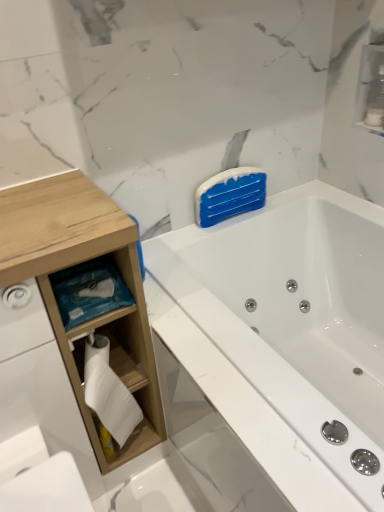
Identify the location of white glossy bathtub at upper right. This screenshot has height=512, width=384. (287, 335).

Is wooden cabinet at left facing away from white glossy cabinet at upper right, which is counted as the first cabinet, starting from the top?

No, white glossy cabinet at upper right, which is counted as the first cabinet, starting from the top, is not at the back of wooden cabinet at left.

From the image's perspective, is wooden cabinet at left beneath white glossy cabinet at upper right, which is counted as the first cabinet, starting from the top?

Correct, wooden cabinet at left appears lower than white glossy cabinet at upper right, which is counted as the first cabinet, starting from the top, in the image.

Based on the photo, which object is more forward, wooden cabinet at left or white glossy cabinet at upper right, which is the second cabinet in left-to-right order?

wooden cabinet at left.

Considering the relative positions of white glossy cabinet at upper right, which is the 2th cabinet from bottom to top, and white wood toilet paper holder at left, arranged as the first cabinet when viewed from the left, in the image provided, is white glossy cabinet at upper right, which is the 2th cabinet from bottom to top, to the left of white wood toilet paper holder at left, arranged as the first cabinet when viewed from the left, from the viewer's perspective?

In fact, white glossy cabinet at upper right, which is the 2th cabinet from bottom to top, is to the right of white wood toilet paper holder at left, arranged as the first cabinet when viewed from the left.

Is white glossy cabinet at upper right, which is the 1th cabinet from right to left, oriented away from white wood toilet paper holder at left, the 1th cabinet in the bottom-to-top sequence?

No, white glossy cabinet at upper right, which is the 1th cabinet from right to left, is not facing the opposite direction of white wood toilet paper holder at left, the 1th cabinet in the bottom-to-top sequence.

From a real-world perspective, relative to white wood toilet paper holder at left, the 2th cabinet in the top-to-bottom sequence, is white glossy cabinet at upper right, which is the second cabinet in left-to-right order, vertically above or below?

Clearly, from a real-world perspective, white glossy cabinet at upper right, which is the second cabinet in left-to-right order, is above white wood toilet paper holder at left, the 2th cabinet in the top-to-bottom sequence.

Is white glossy cabinet at upper right, which is the second cabinet in left-to-right order, not near white wood toilet paper holder at left, the 2th cabinet from the right?

Absolutely, white glossy cabinet at upper right, which is the second cabinet in left-to-right order, is distant from white wood toilet paper holder at left, the 2th cabinet from the right.

Is white glossy bathtub at upper right turned away from wooden cabinet at left?

No, white glossy bathtub at upper right's orientation is not away from wooden cabinet at left.

Locate an element on the screen. The image size is (384, 512). cabinetry behind the white glossy bathtub at upper right is located at coordinates (76, 264).

Considering the positions of objects white glossy bathtub at upper right and wooden cabinet at left in the image provided, who is more to the right, white glossy bathtub at upper right or wooden cabinet at left?

Positioned to the right is white glossy bathtub at upper right.

Is wooden cabinet at left located within white glossy bathtub at upper right?

Actually, wooden cabinet at left is outside white glossy bathtub at upper right.

Can you confirm if wooden cabinet at left is wider than white glossy bathtub at upper right?

Incorrect, the width of wooden cabinet at left does not surpass that of white glossy bathtub at upper right.

From the image's perspective, is wooden cabinet at left located above or below white glossy bathtub at upper right?

wooden cabinet at left is above white glossy bathtub at upper right.

Does wooden cabinet at left have a lesser height compared to white glossy bathtub at upper right?

In fact, wooden cabinet at left may be taller than white glossy bathtub at upper right.

Does point (30, 190) appear closer or farther from the camera than point (270, 428)?

Point (30, 190) is positioned farther from the camera compared to point (270, 428).

Considering the positions of objects white wood toilet paper holder at left, the 2th cabinet in the top-to-bottom sequence, and white glossy bathtub at upper right in the image provided, who is more to the left, white wood toilet paper holder at left, the 2th cabinet in the top-to-bottom sequence, or white glossy bathtub at upper right?

From the viewer's perspective, white wood toilet paper holder at left, the 2th cabinet in the top-to-bottom sequence, appears more on the left side.

From the image's perspective, is white wood toilet paper holder at left, the 2th cabinet in the top-to-bottom sequence, below white glossy bathtub at upper right?

Yes, from the image's perspective, white wood toilet paper holder at left, the 2th cabinet in the top-to-bottom sequence, is beneath white glossy bathtub at upper right.

From a real-world perspective, who is located higher, white wood toilet paper holder at left, the 2th cabinet in the top-to-bottom sequence, or white glossy bathtub at upper right?

In real-world perspective, white wood toilet paper holder at left, the 2th cabinet in the top-to-bottom sequence, is above.

Does white glossy bathtub at upper right turn towards white wood toilet paper holder at left, the 2th cabinet from the right?

Yes, white glossy bathtub at upper right is aimed at white wood toilet paper holder at left, the 2th cabinet from the right.

Which is correct: white glossy bathtub at upper right is inside white wood toilet paper holder at left, the 2th cabinet in the top-to-bottom sequence, or outside of it?

The correct answer is: outside.

Which is in front, white glossy bathtub at upper right or white wood toilet paper holder at left, the 1th cabinet in the bottom-to-top sequence?

white glossy bathtub at upper right is more forward.

Is point (280, 290) closer to viewer compared to point (85, 412)?

No.

Is white wood toilet paper holder at left, the 1th cabinet in the bottom-to-top sequence, facing away from white glossy cabinet at upper right, which is the second cabinet in left-to-right order?

No, white wood toilet paper holder at left, the 1th cabinet in the bottom-to-top sequence, is not facing away from white glossy cabinet at upper right, which is the second cabinet in left-to-right order.

Is point (146, 447) closer to camera compared to point (379, 75)?

No, it is behind (379, 75).

Find the location of a particular element. The image size is (384, 512). cabinet that is in front of the white glossy cabinet at upper right, which is counted as the first cabinet, starting from the top is located at coordinates (92, 416).

Which object is thinner, white wood toilet paper holder at left, the 2th cabinet from the right, or white glossy cabinet at upper right, which is counted as the first cabinet, starting from the top?

white glossy cabinet at upper right, which is counted as the first cabinet, starting from the top, is thinner.

Locate an element on the screen. The image size is (384, 512). cabinetry in front of the white glossy cabinet at upper right, which is counted as the first cabinet, starting from the top is located at coordinates (76, 264).

I want to click on cabinet below the white glossy cabinet at upper right, which is the 1th cabinet from right to left (from a real-world perspective), so click(x=92, y=416).

Which object lies nearer to the anchor point white glossy bathtub at upper right, white wood toilet paper holder at left, the 2th cabinet from the right, or wooden cabinet at left?

wooden cabinet at left lies closer to white glossy bathtub at upper right than the other object.

Looking at the image, which one is located further to white glossy bathtub at upper right, white glossy cabinet at upper right, which is the 2th cabinet from bottom to top, or white wood toilet paper holder at left, the 2th cabinet in the top-to-bottom sequence?

Based on the image, white glossy cabinet at upper right, which is the 2th cabinet from bottom to top, appears to be further to white glossy bathtub at upper right.

Looking at the image, which one is located closer to wooden cabinet at left, white wood toilet paper holder at left, the 1th cabinet in the bottom-to-top sequence, or white glossy bathtub at upper right?

white wood toilet paper holder at left, the 1th cabinet in the bottom-to-top sequence, is positioned closer to the anchor wooden cabinet at left.

Which object lies further to the anchor point white glossy cabinet at upper right, which is the second cabinet in left-to-right order, white glossy bathtub at upper right or white wood toilet paper holder at left, the 1th cabinet in the bottom-to-top sequence?

white wood toilet paper holder at left, the 1th cabinet in the bottom-to-top sequence.

Looking at the image, which one is located closer to white glossy cabinet at upper right, which is the 1th cabinet from right to left, wooden cabinet at left or white wood toilet paper holder at left, arranged as the first cabinet when viewed from the left?

Among the two, wooden cabinet at left is located nearer to white glossy cabinet at upper right, which is the 1th cabinet from right to left.

Based on their spatial positions, is wooden cabinet at left or white glossy cabinet at upper right, which is the 1th cabinet from right to left, further from white glossy bathtub at upper right?

white glossy cabinet at upper right, which is the 1th cabinet from right to left, is positioned further to the anchor white glossy bathtub at upper right.

Based on their spatial positions, is white glossy cabinet at upper right, which is counted as the first cabinet, starting from the top, or wooden cabinet at left closer to white wood toilet paper holder at left, the 2th cabinet in the top-to-bottom sequence?

Among the two, wooden cabinet at left is located nearer to white wood toilet paper holder at left, the 2th cabinet in the top-to-bottom sequence.

Looking at the image, which one is located closer to white glossy cabinet at upper right, which is the second cabinet in left-to-right order, wooden cabinet at left or white glossy bathtub at upper right?

Among the two, white glossy bathtub at upper right is located nearer to white glossy cabinet at upper right, which is the second cabinet in left-to-right order.

Image resolution: width=384 pixels, height=512 pixels. Find the location of `bathtub between wooden cabinet at left and white glossy cabinet at upper right, which is the 2th cabinet from bottom to top, from left to right`. bathtub between wooden cabinet at left and white glossy cabinet at upper right, which is the 2th cabinet from bottom to top, from left to right is located at coordinates (287, 335).

Locate an element on the screen. The width and height of the screenshot is (384, 512). cabinet between wooden cabinet at left and white glossy bathtub at upper right in the horizontal direction is located at coordinates (92, 416).

Find the location of a particular element. This screenshot has width=384, height=512. cabinet between wooden cabinet at left and white glossy cabinet at upper right, which is counted as the first cabinet, starting from the top is located at coordinates (92, 416).

Find the location of a particular element. This screenshot has width=384, height=512. bathtub between white glossy cabinet at upper right, which is the 1th cabinet from right to left, and white wood toilet paper holder at left, the 1th cabinet in the bottom-to-top sequence, from top to bottom is located at coordinates (287, 335).